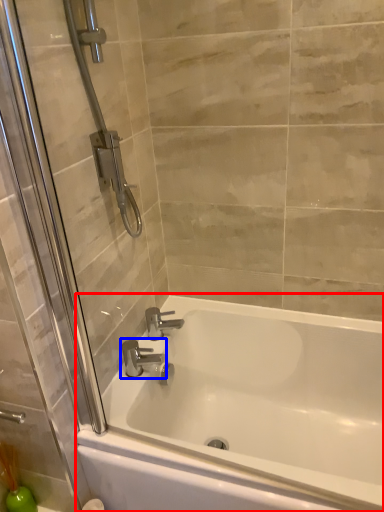
Question: Which object is further to the camera taking this photo, bathtub (highlighted by a red box) or tap (highlighted by a blue box)?

Choices:
 (A) bathtub
 (B) tap

Answer: (B)